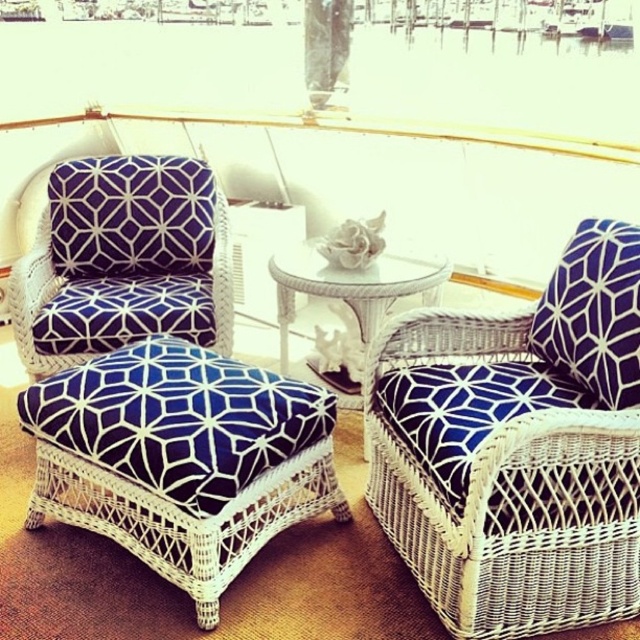
You are planning to place a small tray of drinks on the glassy white table at center. Considering the size of the navy blue fabric stool at center, will the tray fit comfortably on the table?

The navy blue fabric stool at center is larger in size than the glassy white table at center, so the table might be too small to accommodate a tray comfortably. Ensure the tray is not too large or consider placing it elsewhere for stability.

You are standing at the point labeled as point (132, 492) on the boat deck. If you want to walk towards the railing, which direction should you move?

The point (132, 492) is 6.05 feet away from the viewer. To walk towards the railing, you should move forward since the railing is likely at the edge of the deck, which is in front of the viewer.

Consider the image. You are a guest on the boat deck and want to sit comfortably between the two white wicker chairs. There is a navy blue fabric stool at center and a glassy white table at center. Which object should you sit on to ensure your feet touch the floor?

The navy blue fabric stool at center is taller than the glassy white table at center, so you should choose the glassy white table at center to sit on since it is shorter and your feet will touch the floor.